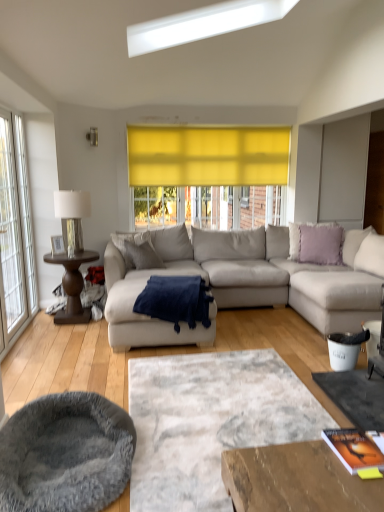
Question: Does light gray fabric couch at center have a greater height compared to gray fabric pillow at center, which is the first pillow in left-to-right order?

Choices:
 (A) yes
 (B) no

Answer: (A)

Question: Considering the relative sizes of light gray fabric couch at center and gray fabric pillow at center, which is the first pillow in left-to-right order, in the image provided, is light gray fabric couch at center smaller than gray fabric pillow at center, which is the first pillow in left-to-right order,?

Choices:
 (A) no
 (B) yes

Answer: (A)

Question: Is light gray fabric couch at center to the right of gray fabric pillow at center, which is the first pillow in left-to-right order, from the viewer's perspective?

Choices:
 (A) yes
 (B) no

Answer: (A)

Question: From the image's perspective, is light gray fabric couch at center located above gray fabric pillow at center, which is the first pillow in left-to-right order?

Choices:
 (A) yes
 (B) no

Answer: (B)

Question: From a real-world perspective, is light gray fabric couch at center under gray fabric pillow at center, which is the 2th pillow from right to left?

Choices:
 (A) yes
 (B) no

Answer: (A)

Question: Is metallic silver lamp at left situated inside lavender soft cushion at upper right, marked as the 2th pillow in a left-to-right arrangement, or outside?

Choices:
 (A) outside
 (B) inside

Answer: (A)

Question: Based on their sizes in the image, would you say metallic silver lamp at left is bigger or smaller than lavender soft cushion at upper right, marked as the 2th pillow in a left-to-right arrangement?

Choices:
 (A) big
 (B) small

Answer: (A)

Question: Relative to lavender soft cushion at upper right, the 1th pillow in the right-to-left sequence, is metallic silver lamp at left in front or behind?

Choices:
 (A) behind
 (B) front

Answer: (B)

Question: Would you say metallic silver lamp at left is to the left or to the right of lavender soft cushion at upper right, the 1th pillow in the right-to-left sequence, in the picture?

Choices:
 (A) left
 (B) right

Answer: (A)

Question: Would you say navy blue plush blanket at center is inside or outside textured gray rug at center?

Choices:
 (A) outside
 (B) inside

Answer: (A)

Question: In the image, is navy blue plush blanket at center positioned in front of or behind textured gray rug at center?

Choices:
 (A) behind
 (B) front

Answer: (A)

Question: From a real-world perspective, is navy blue plush blanket at center above or below textured gray rug at center?

Choices:
 (A) above
 (B) below

Answer: (A)

Question: Considering the relative positions of navy blue plush blanket at center and textured gray rug at center in the image provided, is navy blue plush blanket at center to the left or to the right of textured gray rug at center?

Choices:
 (A) left
 (B) right

Answer: (A)

Question: Relative to light gray fabric couch at center, is gray plush cat bed at lower left in front or behind?

Choices:
 (A) front
 (B) behind

Answer: (A)

Question: Considering the positions of gray plush cat bed at lower left and light gray fabric couch at center in the image, is gray plush cat bed at lower left wider or thinner than light gray fabric couch at center?

Choices:
 (A) wide
 (B) thin

Answer: (B)